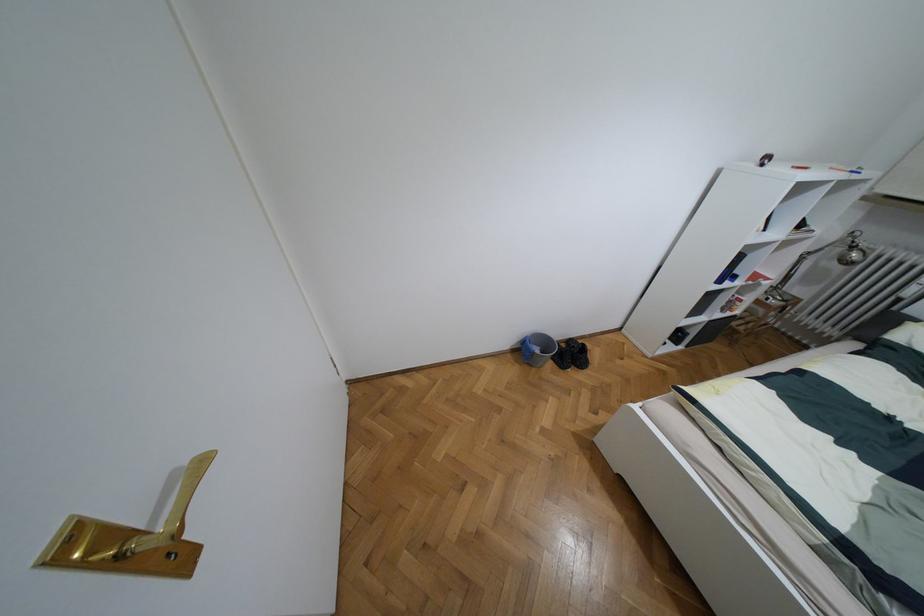
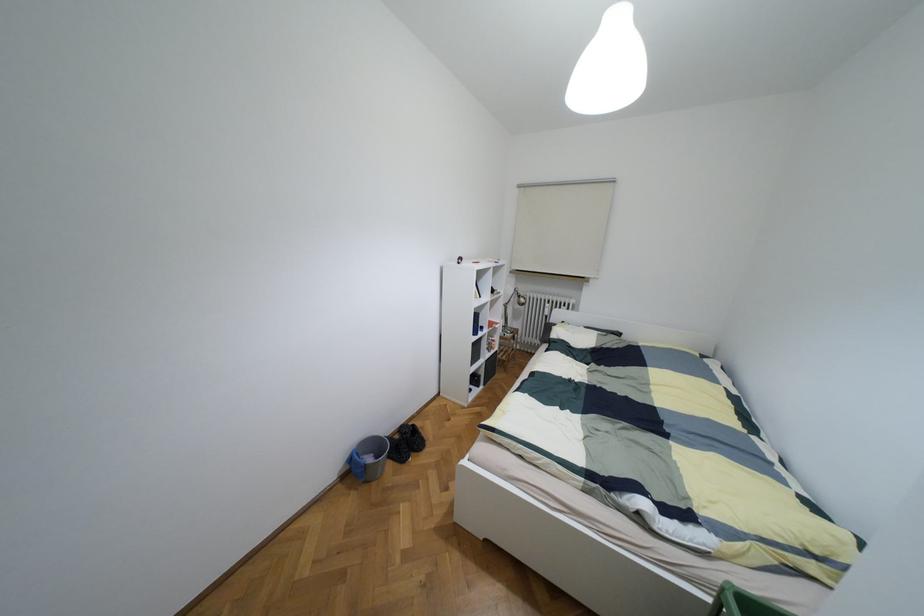
Find the pixel in the second image that matches [536,350] in the first image.

(369, 459)